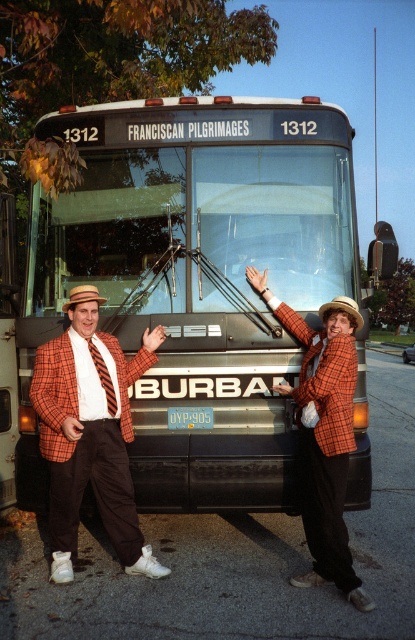
Question: Which of the following is the closest to the observer?

Choices:
 (A) (359, 323)
 (B) (199, 218)

Answer: (A)

Question: Does plaid wool blazer at center have a greater width compared to blue plastic license plate at center?

Choices:
 (A) no
 (B) yes

Answer: (B)

Question: Considering the relative positions of orange checkered blazer at center and brown straw cowboy hat at center in the image provided, where is orange checkered blazer at center located with respect to brown straw cowboy hat at center?

Choices:
 (A) below
 (B) above

Answer: (A)

Question: Is plaid wool blazer at center smaller than blue plastic license plate at center?

Choices:
 (A) no
 (B) yes

Answer: (A)

Question: Among these objects, which one is farthest from the camera?

Choices:
 (A) orange checkered blazer at center
 (B) orange plaid blazer at center
 (C) plaid wool blazer at center

Answer: (A)

Question: Which object is positioned farthest from the brown straw cowboy hat at center?

Choices:
 (A) plaid wool blazer at center
 (B) metallic silver bus at center
 (C) orange plaid blazer at center
 (D) blue plastic license plate at center

Answer: (B)